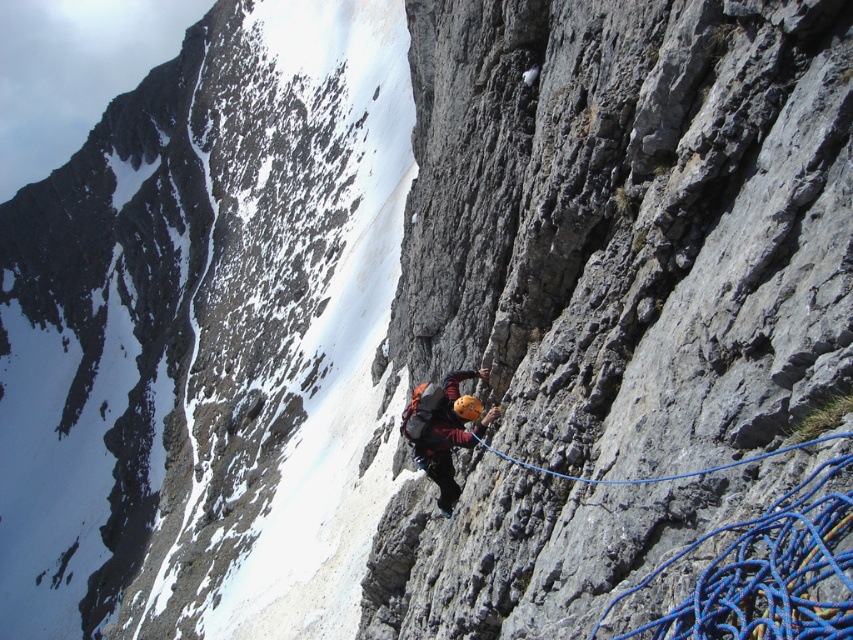
Can you confirm if orange helmet at center is positioned above blue nylon rope at center-right?

Actually, orange helmet at center is below blue nylon rope at center-right.

Between orange helmet at center and blue nylon rope at center-right, which one appears on the right side from the viewer's perspective?

Positioned to the right is blue nylon rope at center-right.

Is point (474, 442) closer to viewer compared to point (613, 480)?

That is False.

You are a GUI agent. You are given a task and a screenshot of the screen. Output one action in this format:
    pyautogui.click(x=<x>, y=<y>)
    Task: Click on the orange helmet at center
    This screenshot has width=853, height=640.
    Given the screenshot: What is the action you would take?
    pyautogui.click(x=439, y=433)